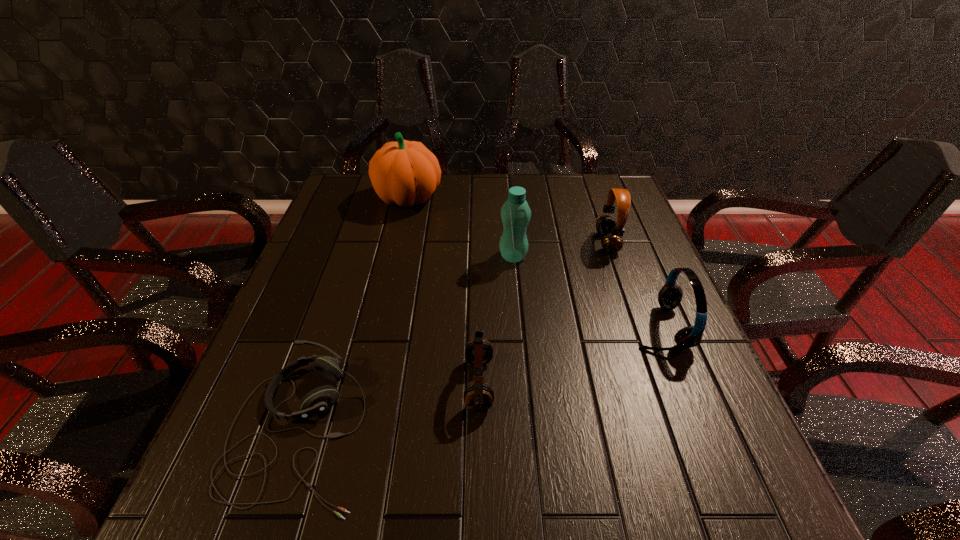
The image size is (960, 540). What are the coordinates of `vacant region located 0.150m on the ear cups of the farthest headset` in the screenshot? It's located at (542, 242).

I want to click on free space located 0.300m on the ear cups of the farthest headset, so click(x=488, y=242).

Image resolution: width=960 pixels, height=540 pixels. Identify the location of vacant space located 0.050m on the ear cups of the third headset from right to left. (518, 384).

The height and width of the screenshot is (540, 960). I want to click on free space located on the outer surface of the shortest object, so click(533, 430).

Identify the location of object positioned at the far edge. click(404, 173).

You are a GUI agent. You are given a task and a screenshot of the screen. Output one action in this format:
    pyautogui.click(x=<x>, y=<y>)
    Task: Click on the object positioned at the near edge
    
    Given the screenshot: What is the action you would take?
    pyautogui.click(x=319, y=400)

Locate an element on the screen. The image size is (960, 540). pumpkin that is at the left edge is located at coordinates (404, 173).

You are a GUI agent. You are given a task and a screenshot of the screen. Output one action in this format:
    pyautogui.click(x=<x>, y=<y>)
    Task: Click on the headset situated at the left edge
    The width and height of the screenshot is (960, 540).
    Given the screenshot: What is the action you would take?
    pyautogui.click(x=319, y=400)

The image size is (960, 540). In order to click on object present at the far left corner in this screenshot , I will do `click(404, 173)`.

Find the location of `object that is at the near left corner`. object that is at the near left corner is located at coordinates (319, 400).